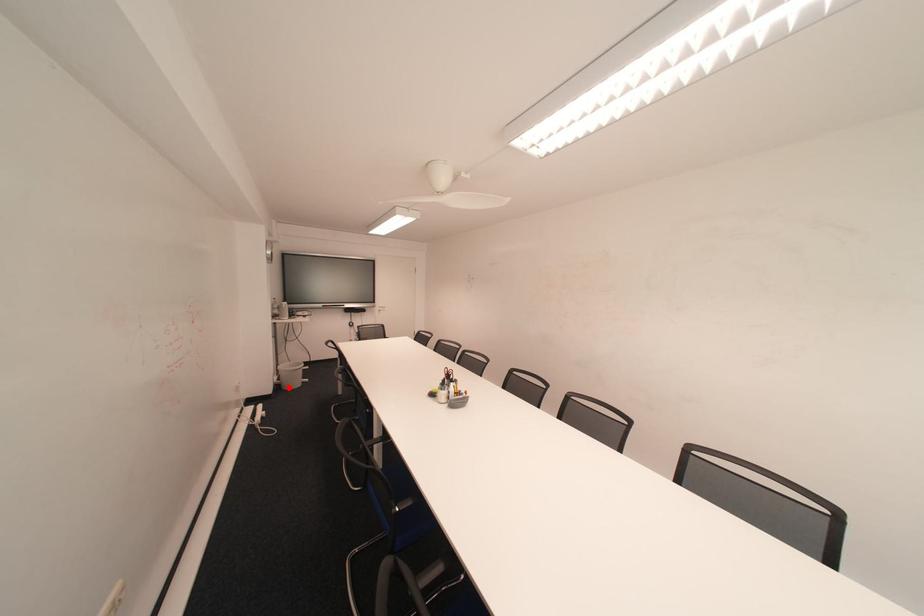
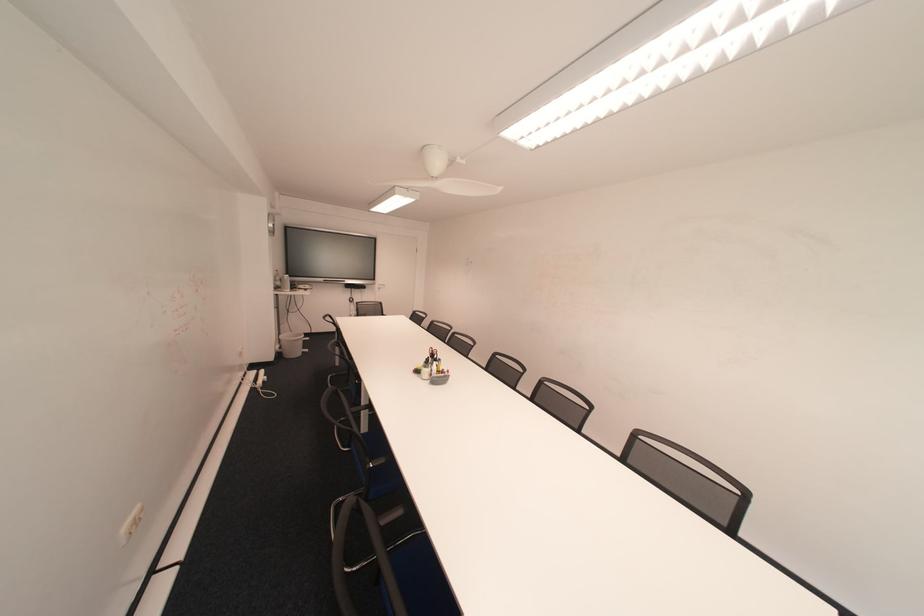
Where in the second image is the point corresponding to the highlighted location from the first image?

(290, 355)